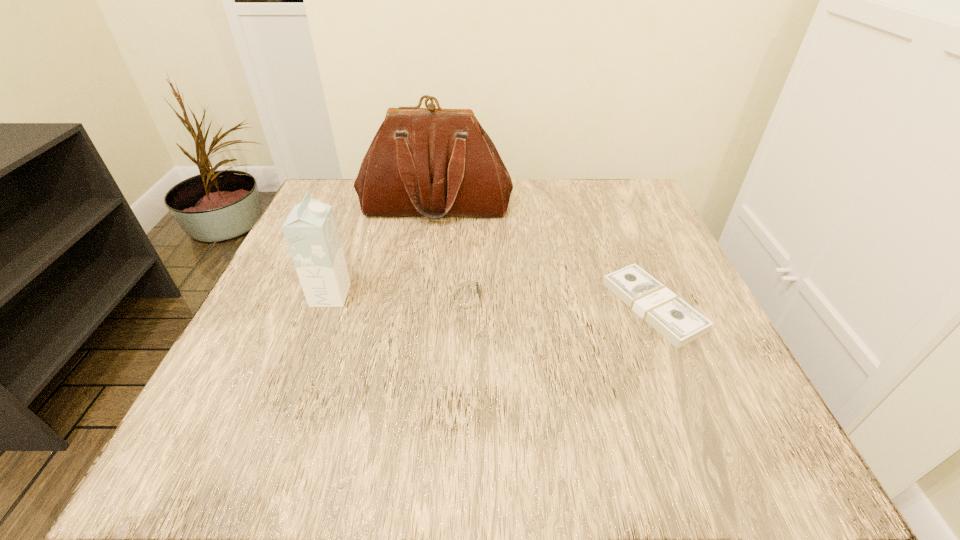
Where is `vacant space at the far right corner of the desktop`? The image size is (960, 540). vacant space at the far right corner of the desktop is located at coordinates click(614, 185).

Find the location of a particular element. This screenshot has height=540, width=960. empty location between the second shortest object and the tallest object is located at coordinates (451, 251).

The image size is (960, 540). Identify the location of vacant area between the tallest object and the shortest object. point(544,256).

At what (x,y) coordinates should I click in order to perform the action: click on free area in between the watch and the carton. Please return your answer as a coordinate pair (x, y). Looking at the image, I should click on (399, 295).

Locate an element on the screen. Image resolution: width=960 pixels, height=540 pixels. empty space between the shoulder bag and the third shortest object is located at coordinates (383, 251).

Where is `unoccupied area between the watch and the farthest object`? unoccupied area between the watch and the farthest object is located at coordinates (451, 251).

Where is `free space between the second shortest object and the carton`? The height and width of the screenshot is (540, 960). free space between the second shortest object and the carton is located at coordinates (399, 295).

I want to click on free space between the watch and the carton, so click(399, 295).

At what (x,y) coordinates should I click in order to perform the action: click on vacant point located between the tallest object and the carton. Please return your answer as a coordinate pair (x, y). Looking at the image, I should click on (383, 251).

Identify the location of object that is the closest one to the shortest object. This screenshot has height=540, width=960. (466, 296).